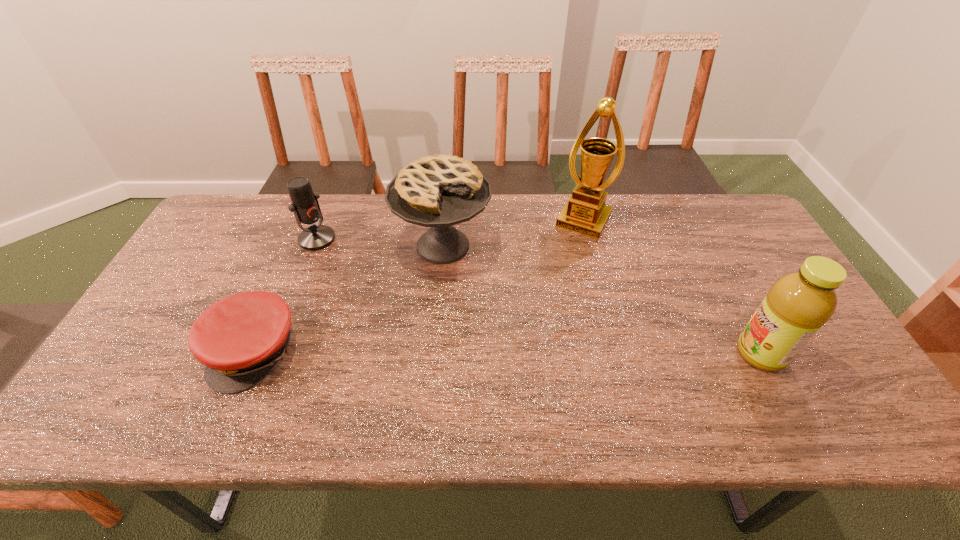
Where is `microphone situated at the far edge`? This screenshot has height=540, width=960. microphone situated at the far edge is located at coordinates (305, 206).

Where is `cap positioned at the near edge`? cap positioned at the near edge is located at coordinates (239, 339).

Where is `fruit juice at the near edge`? fruit juice at the near edge is located at coordinates (798, 304).

What are the coordinates of `object positioned at the right edge` in the screenshot? It's located at (798, 304).

You are a GUI agent. You are given a task and a screenshot of the screen. Output one action in this format:
    pyautogui.click(x=<x>, y=<y>)
    Task: Click on the object located at the near right corner
    The width and height of the screenshot is (960, 540).
    Given the screenshot: What is the action you would take?
    pyautogui.click(x=798, y=304)

Identify the location of vacant space at the far edge of the desktop. (355, 215).

Where is `blank area at the near edge`? blank area at the near edge is located at coordinates point(584,390).

What are the coordinates of `free space at the left edge of the desktop` in the screenshot? It's located at (186, 327).

Locate an element on the screen. The width and height of the screenshot is (960, 540). vacant space at the far left corner of the desktop is located at coordinates (241, 200).

You are a GUI agent. You are given a task and a screenshot of the screen. Output one action in this format:
    pyautogui.click(x=<x>, y=<y>)
    Task: Click on the vacant space at the far right corner
    
    Given the screenshot: What is the action you would take?
    [719, 234]